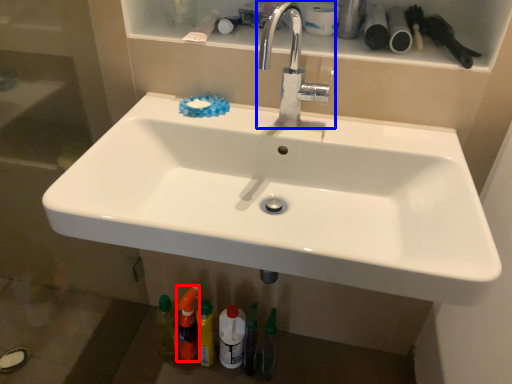
Question: Which object appears closest to the camera in this image, toiletry (highlighted by a red box) or tap (highlighted by a blue box)?

Choices:
 (A) toiletry
 (B) tap

Answer: (B)